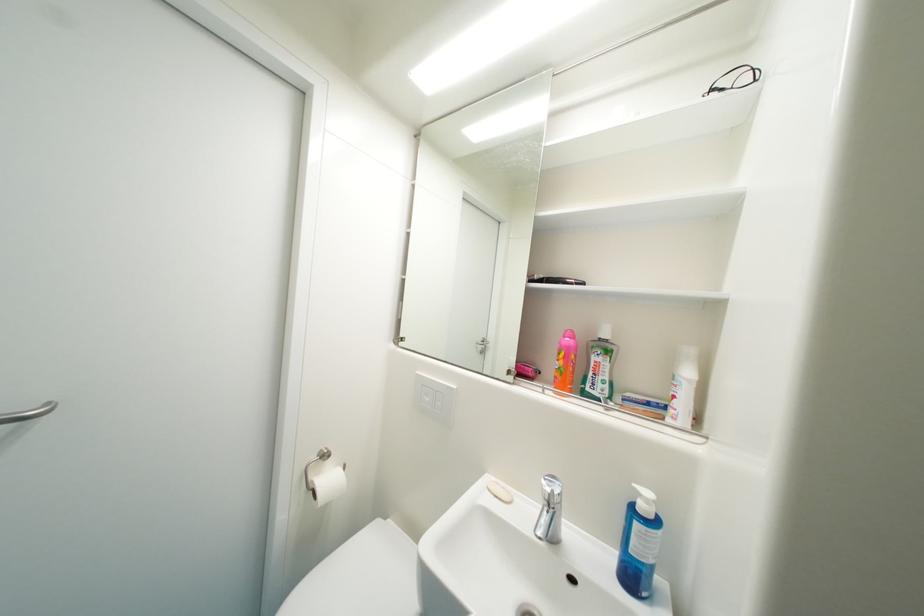
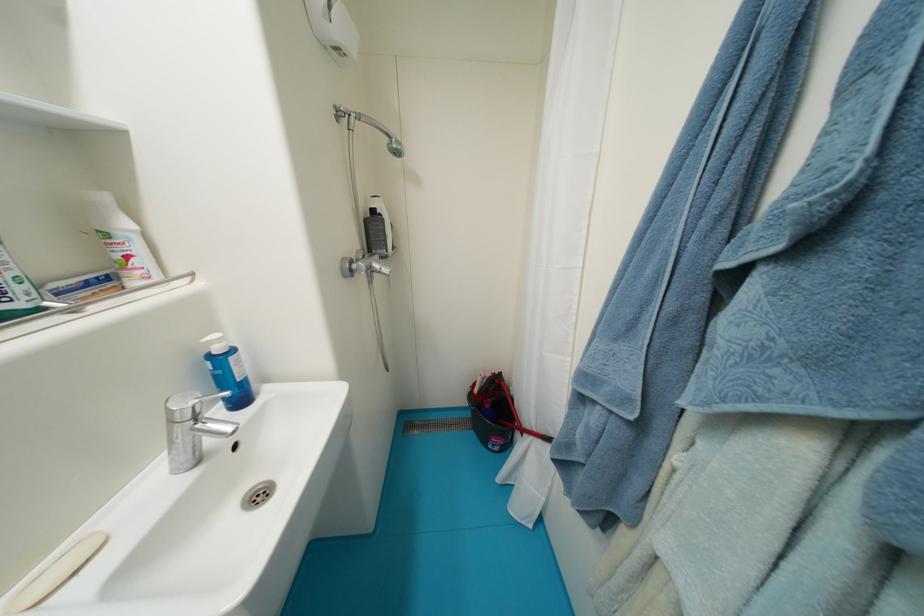
Where in the second image is the point corresponding to (653,503) from the first image?

(225, 342)